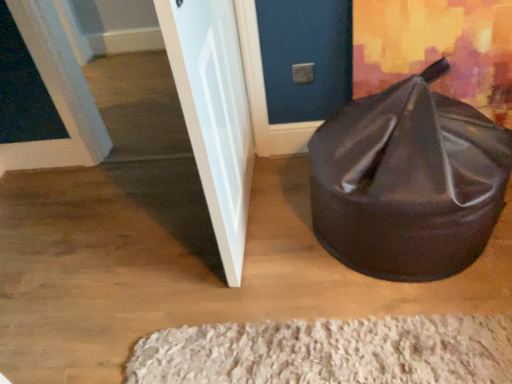
Where is `vacant area that lies between white glossy door at left, which is the 1th door in right-to-left order, and black leather bean bag at lower right`? The image size is (512, 384). vacant area that lies between white glossy door at left, which is the 1th door in right-to-left order, and black leather bean bag at lower right is located at coordinates (281, 220).